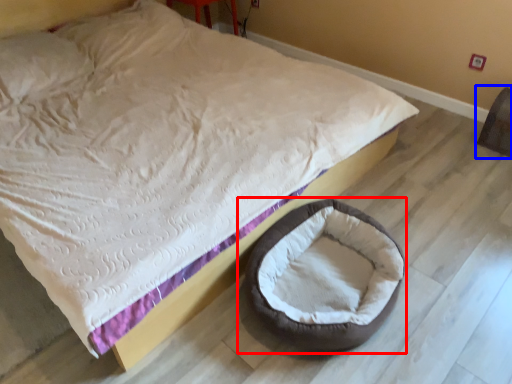
Question: Which point is closer to the camera, dog bed (highlighted by a red box) or bean bag chair (highlighted by a blue box)?

Choices:
 (A) dog bed
 (B) bean bag chair

Answer: (A)